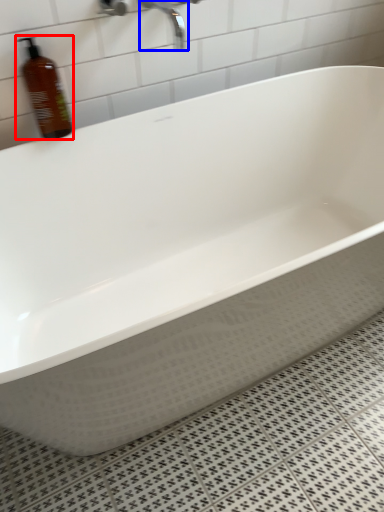
Question: Which object appears farthest to the camera in this image, bottle (highlighted by a red box) or faucet (highlighted by a blue box)?

Choices:
 (A) bottle
 (B) faucet

Answer: (B)